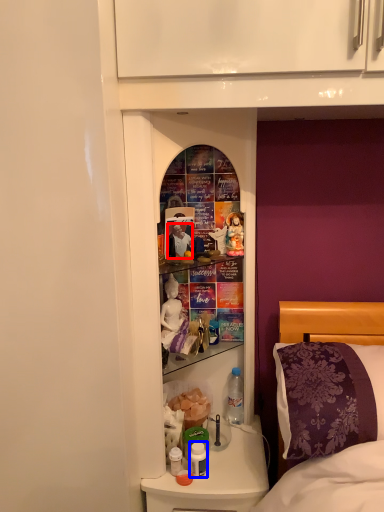
Question: Which of the following is the closest to the observer, person (highlighted by a red box) or bottle (highlighted by a blue box)?

Choices:
 (A) person
 (B) bottle

Answer: (B)